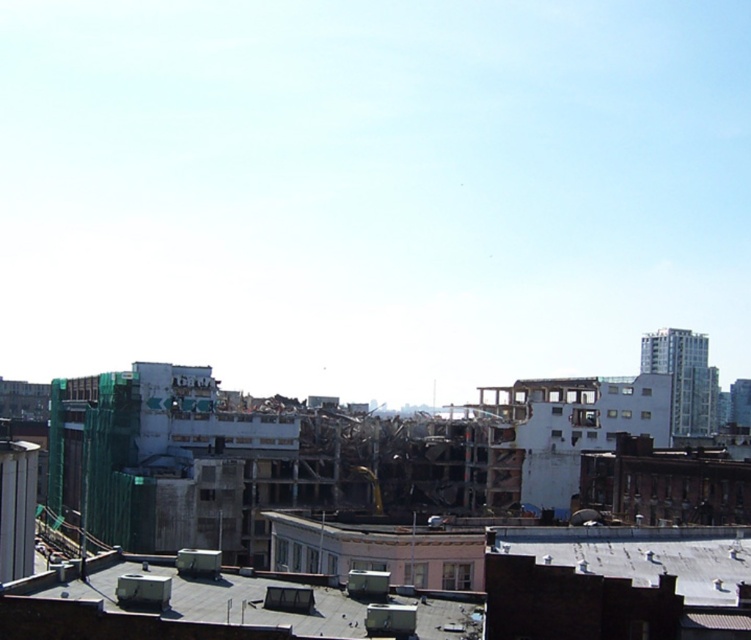
Which is more to the left, concrete rubble at center or gray concrete roof at lower center?

gray concrete roof at lower center is more to the left.

Is concrete rubble at center thinner than gray concrete roof at lower center?

No.

Locate an element on the screen. This screenshot has width=751, height=640. concrete rubble at center is located at coordinates (339, 532).

The height and width of the screenshot is (640, 751). In order to click on concrete rubble at center in this screenshot , I will do `click(339, 532)`.